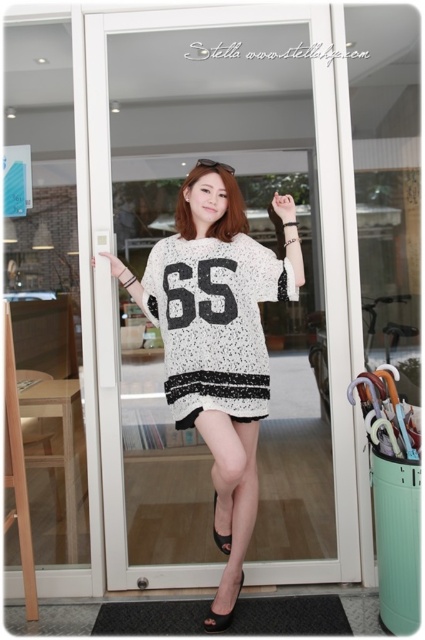
You are a fashion designer observing two garments in the image. The first is the white textured sweater at center, and the second is the white dotted jersey at center. Which garment has a larger size?

The white textured sweater at center is bigger than the white dotted jersey at center, so the white textured sweater at center has a larger size.